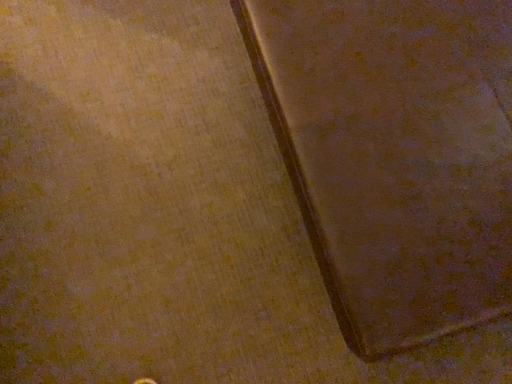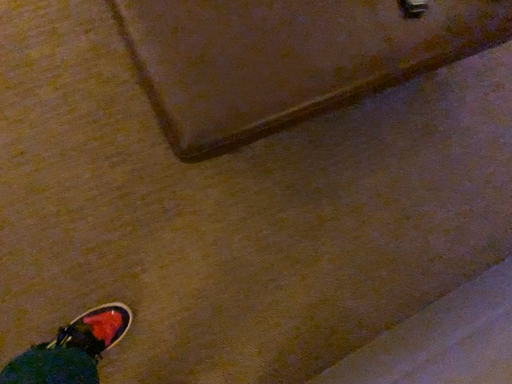
Question: Which way did the camera rotate in the video?

Choices:
 (A) rotated downward
 (B) rotated upward

Answer: (A)